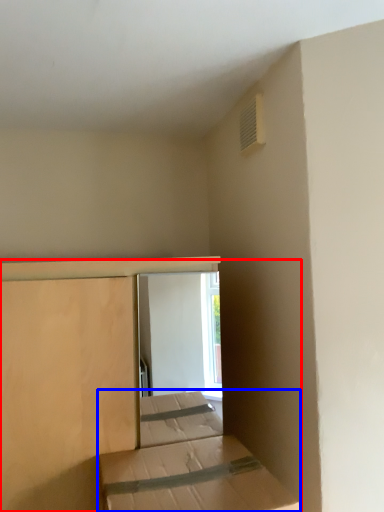
Question: Which point is further to the camera, bed (highlighted by a red box) or bed (highlighted by a blue box)?

Choices:
 (A) bed
 (B) bed

Answer: (A)